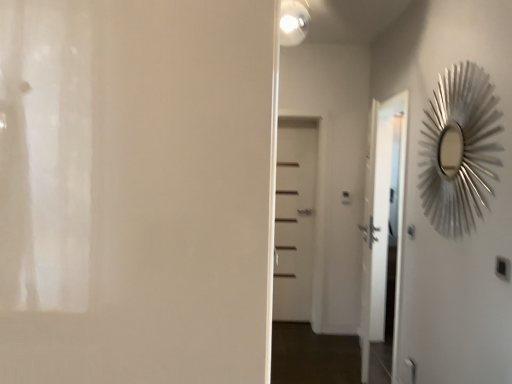
Question: Is white matte door at center, the second door viewed from the right, inside or outside of white matte door at center, placed as the 1th door when sorted from right to left?

Choices:
 (A) outside
 (B) inside

Answer: (A)

Question: From their relative heights in the image, would you say white matte door at center, the second door viewed from the right, is taller or shorter than white matte door at center, arranged as the second door when viewed from the front?

Choices:
 (A) short
 (B) tall

Answer: (A)

Question: Which object is positioned closest to the white glossy light fixture at upper center?

Choices:
 (A) silver metallic sunburst mirror at right
 (B) silver metallic sunburst mirror at upper right
 (C) black plastic light switch at lower right
 (D) white matte door at center, arranged as the second door when viewed from the front
 (E) white matte door at center, positioned as the 2th door in back-to-front order

Answer: (B)

Question: Which object is positioned closest to the white matte door at center, positioned as the 2th door in back-to-front order?

Choices:
 (A) white glossy light fixture at upper center
 (B) white matte door at center, which is counted as the 2th door, starting from the left
 (C) black plastic light switch at lower right
 (D) silver metallic sunburst mirror at right
 (E) silver metallic sunburst mirror at upper right

Answer: (C)